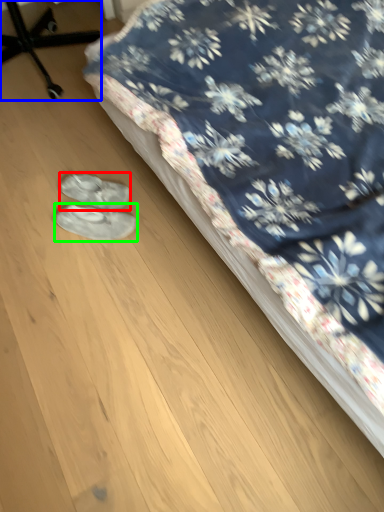
Question: Which object is the farthest from footwear (highlighted by a red box)? Choose among these: furniture (highlighted by a blue box) or footwear (highlighted by a green box).

Choices:
 (A) furniture
 (B) footwear

Answer: (A)